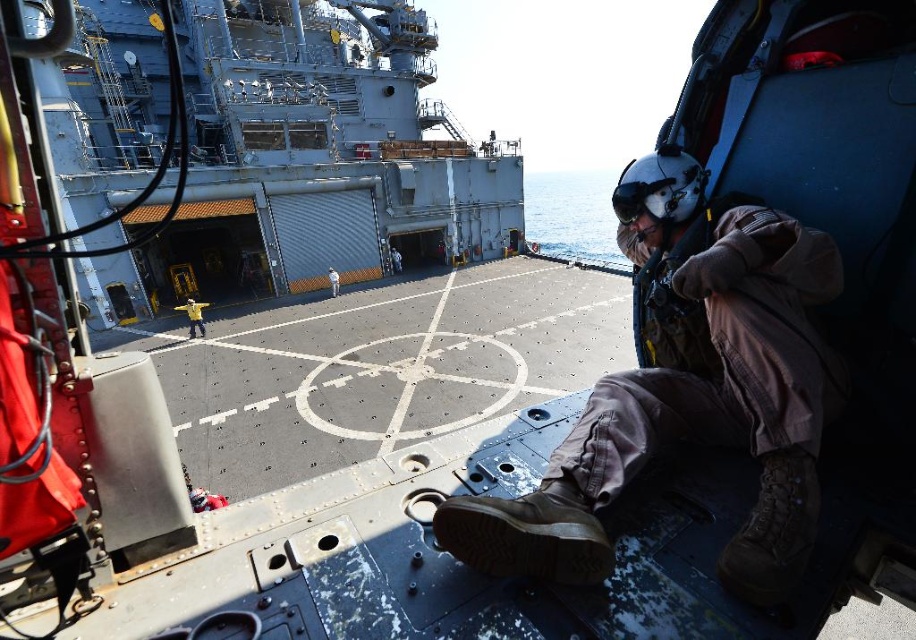
Can you confirm if gray metallic boat at center is positioned to the right of yellow fabric at center?

Yes, gray metallic boat at center is to the right of yellow fabric at center.

Is gray metallic boat at center behind yellow fabric at center?

No, it is in front of yellow fabric at center.

Where is `gray metallic boat at center`? gray metallic boat at center is located at coordinates (315, 156).

Identify the location of gray metallic boat at center. This screenshot has height=640, width=916. (315, 156).

From the picture: Which of these two, black matte helmet at upper right or yellow fabric at center, stands taller?

With more height is black matte helmet at upper right.

Can you confirm if black matte helmet at upper right is positioned below yellow fabric at center?

No, black matte helmet at upper right is not below yellow fabric at center.

Is point (666, 221) positioned behind point (184, 308)?

No, it is not.

This screenshot has width=916, height=640. What are the coordinates of `black matte helmet at upper right` in the screenshot? It's located at (645, 198).

What do you see at coordinates (315, 156) in the screenshot? This screenshot has width=916, height=640. I see `gray metallic boat at center` at bounding box center [315, 156].

Is point (108, 26) positioned before point (613, 205)?

No, it is not.

Find the location of a particular element. gray metallic boat at center is located at coordinates (315, 156).